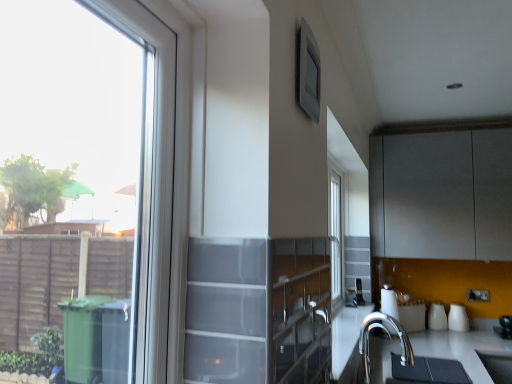
Question: Is polished chrome faucet at lower right inside or outside of matte gray window screen at upper center?

Choices:
 (A) outside
 (B) inside

Answer: (A)

Question: Considering the positions of polished chrome faucet at lower right and matte gray window screen at upper center in the image, is polished chrome faucet at lower right taller or shorter than matte gray window screen at upper center?

Choices:
 (A) short
 (B) tall

Answer: (B)

Question: Which of these objects is positioned farthest from the matte gray cabinet at upper right?

Choices:
 (A) white glossy cups at lower right, placed as the second appliance when sorted from right to left
 (B) polished chrome faucet at lower right
 (C) matte gray window screen at upper center
 (D) satin silver toaster at lower center, acting as the 3th appliance starting from the right
 (E) clear glass window at left

Answer: (E)

Question: Based on their relative distances, which object is farther from the clear glass window at left?

Choices:
 (A) polished chrome faucet at lower right
 (B) matte gray window screen at upper center
 (C) matte gray cabinet at upper right
 (D) satin silver toaster at lower center, acting as the 3th appliance starting from the right
 (E) white glossy cups at lower right, placed as the second appliance when sorted from right to left

Answer: (E)